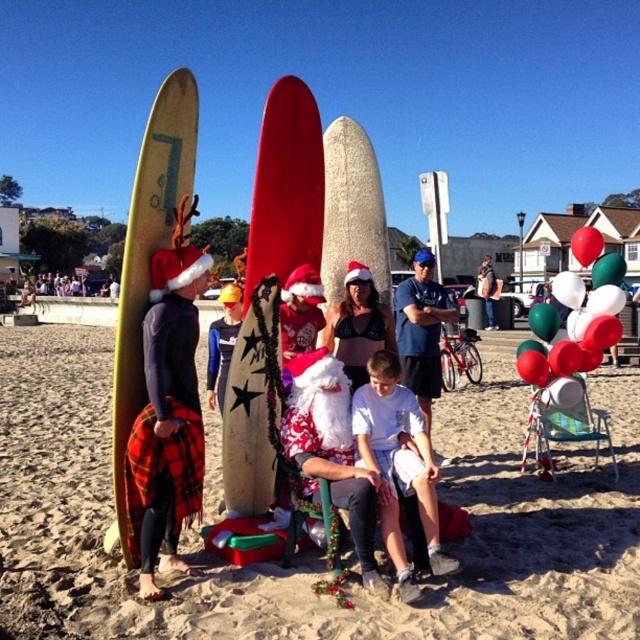
Question: Which point is closer to the camera?

Choices:
 (A) (224, 380)
 (B) (241, 416)
 (C) (186, 172)
 (D) (177, 310)

Answer: (D)

Question: Does smooth sand at center lie in front of blue fabric shirt at center?

Choices:
 (A) no
 (B) yes

Answer: (B)

Question: Which point appears closest to the camera in this image?

Choices:
 (A) (214, 396)
 (B) (410, 316)
 (C) (115, 452)

Answer: (C)

Question: Which of the following is the closest to the observer?

Choices:
 (A) santa hat bikini top at center
 (B) blue long-sleeve shirt at center
 (C) smooth beige surfboard at center

Answer: (C)

Question: Is white cotton shirt at center smaller than santa hat bikini top at center?

Choices:
 (A) yes
 (B) no

Answer: (B)

Question: Does red matte surfboard at center have a greater width compared to plaid fabric surfboard at left?

Choices:
 (A) yes
 (B) no

Answer: (B)